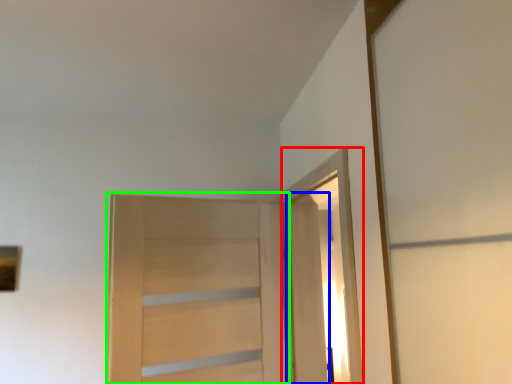
Question: Which object is positioned farthest from elevator (highlighted by a red box)? Select from door (highlighted by a blue box) and door (highlighted by a green box).

Choices:
 (A) door
 (B) door

Answer: (B)